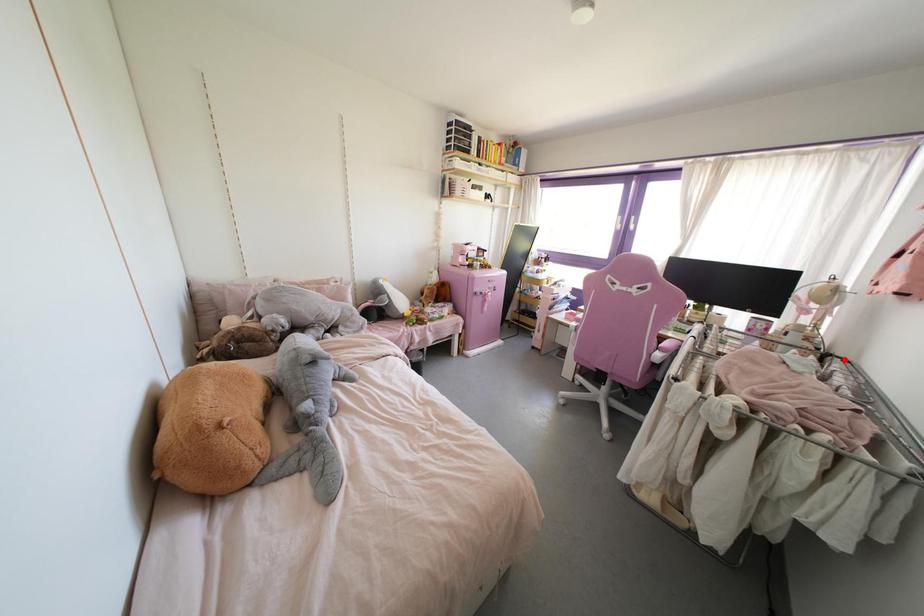
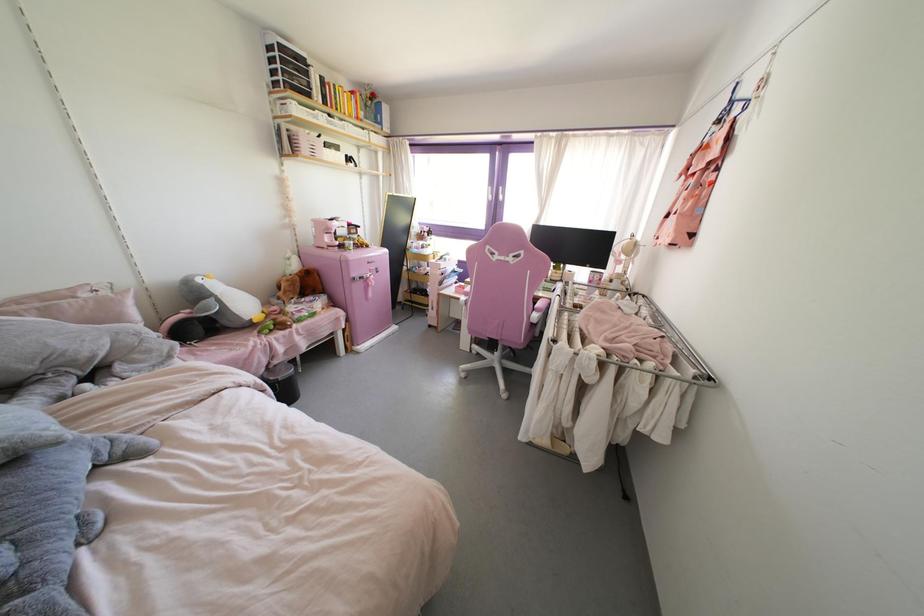
Locate, in the second image, the point that corresponds to the highlighted location in the first image.

(642, 294)